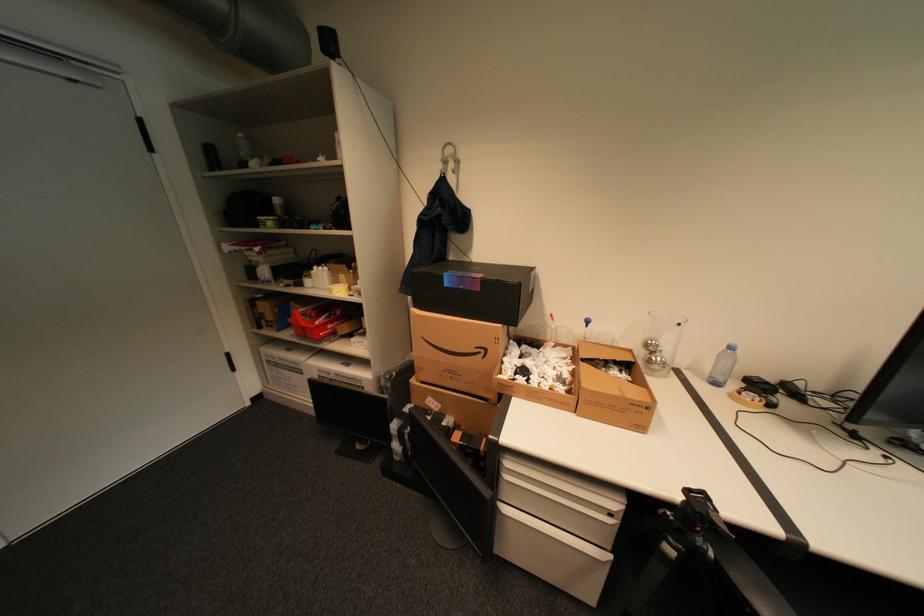
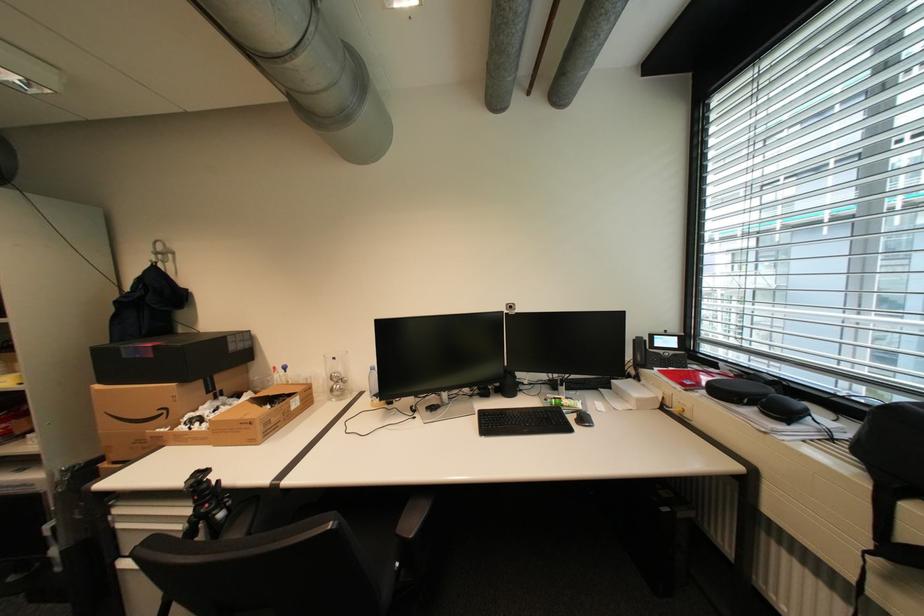
The images are taken continuously from a first-person perspective. In which direction are you moving?

The cameraman walked toward right, backward.